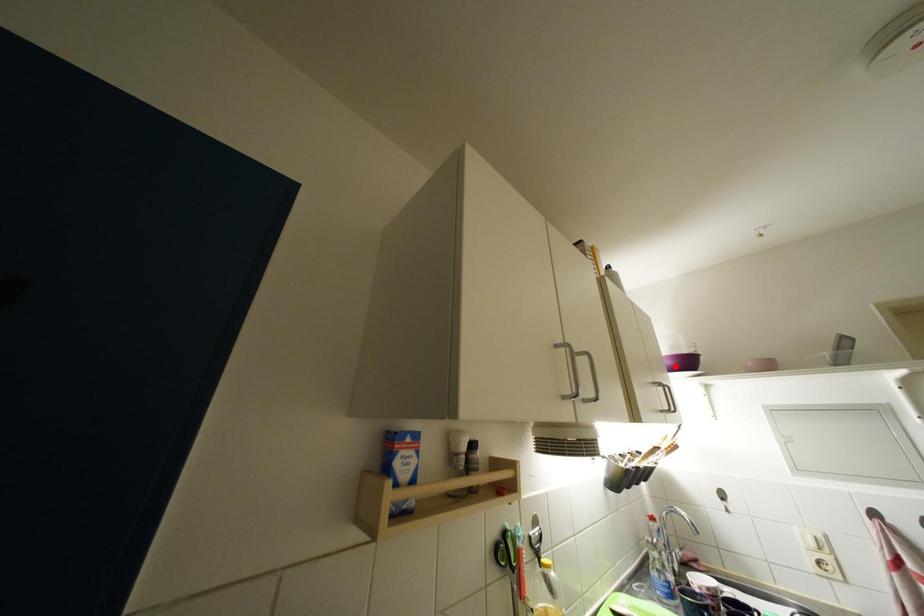
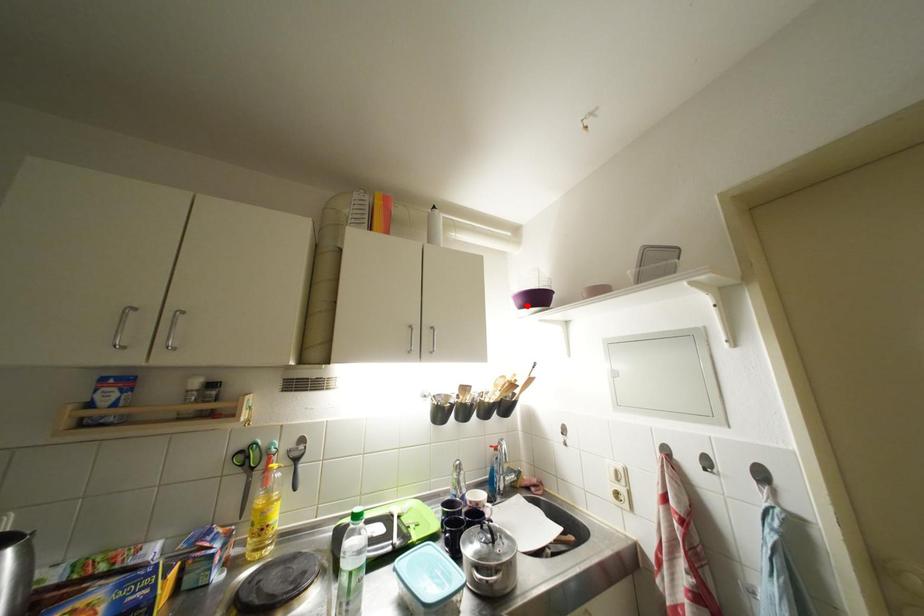
I am providing you with two images of the same scene from different viewpoints. A red point is marked on the first image and another point is marked on the second image. Does the point marked in image1 correspond to the same location as the one in image2?

Yes